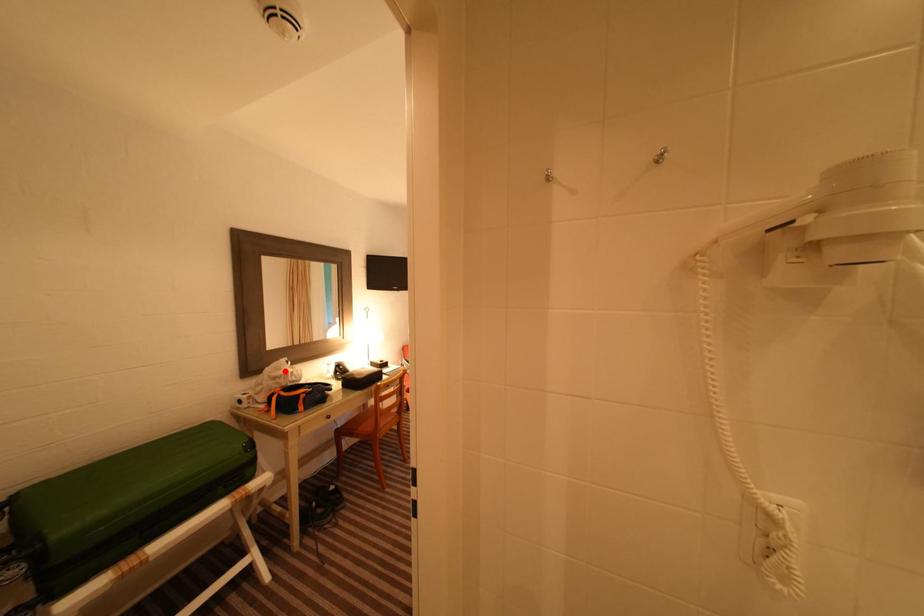
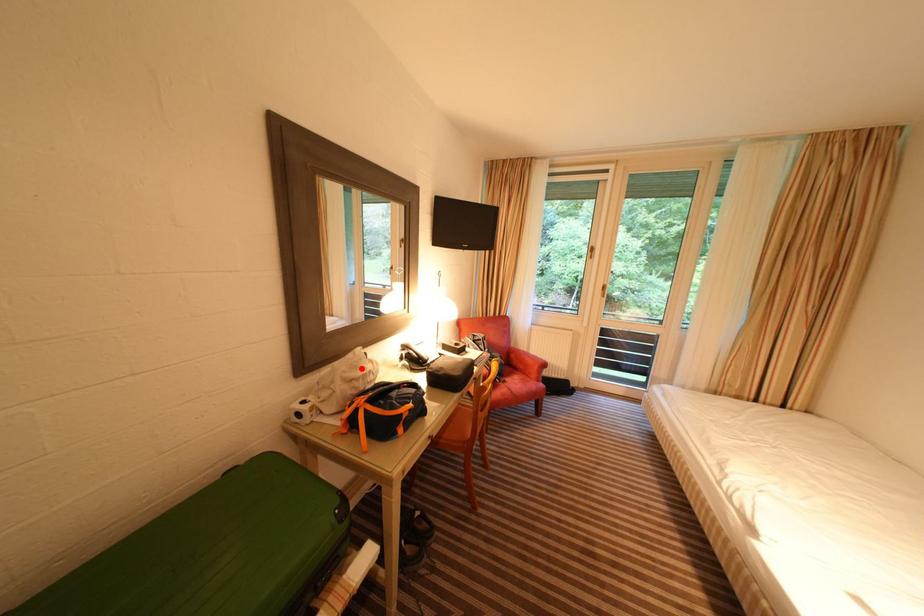
I am providing you with two images of the same scene from different viewpoints. A red point is marked on the first image and another point is marked on the second image. Do the highlighted points in image1 and image2 indicate the same real-world spot?

Yes